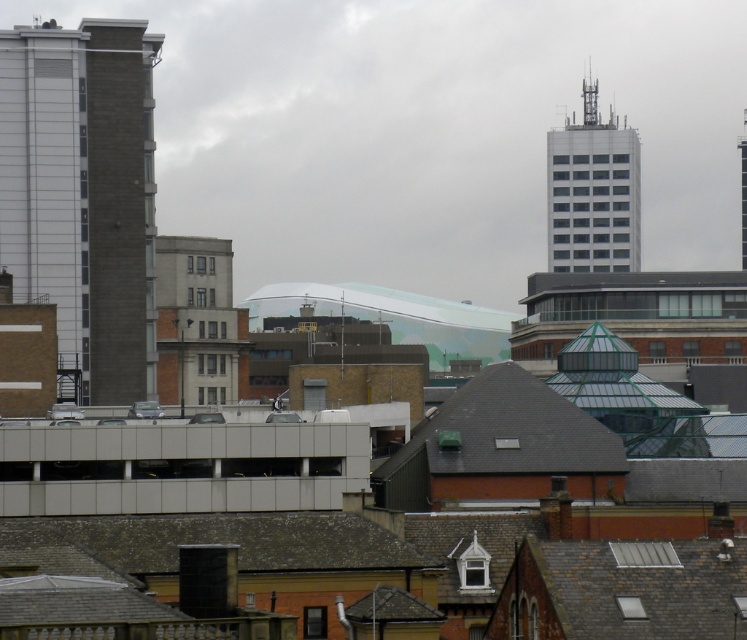
Can you confirm if gray slate roof at center is shorter than white glass building at upper right?

Indeed, gray slate roof at center has a lesser height compared to white glass building at upper right.

Is point (509, 419) less distant than point (560, 147)?

Yes, it is.

At what (x,y) coordinates should I click in order to perform the action: click on gray slate roof at center. Please return your answer as a coordinate pair (x, y). The height and width of the screenshot is (640, 747). Looking at the image, I should click on (509, 432).

Where is `gray slate roof at center`? This screenshot has height=640, width=747. gray slate roof at center is located at coordinates (509, 432).

Which of these two, gray slate roof at center or smooth glass tower at upper right, stands taller?

smooth glass tower at upper right

Locate an element on the screen. The width and height of the screenshot is (747, 640). gray slate roof at center is located at coordinates (509, 432).

Is point (571, 230) positioned behind point (740, 186)?

No, (571, 230) is closer to viewer.

The width and height of the screenshot is (747, 640). Describe the element at coordinates (592, 193) in the screenshot. I see `white glass building at upper right` at that location.

Where is `white glass building at upper right`? The image size is (747, 640). white glass building at upper right is located at coordinates (592, 193).